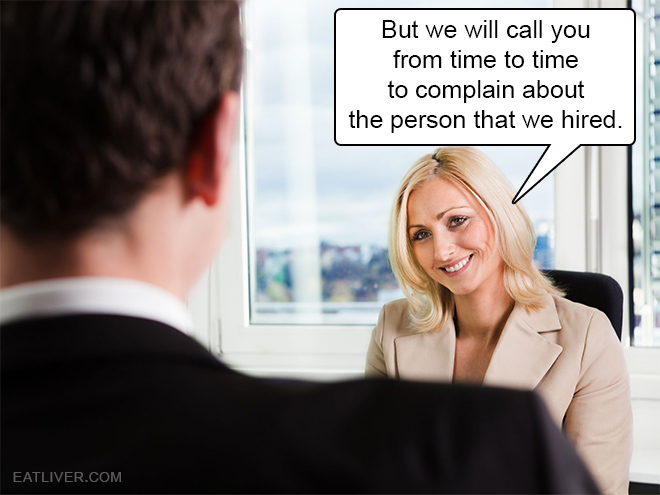
You are a GUI agent. You are given a task and a screenshot of the screen. Output one action in this format:
    pyautogui.click(x=<x>, y=<y>)
    Task: Click on the white window frame
    
    Given the screenshot: What is the action you would take?
    pyautogui.click(x=341, y=342)